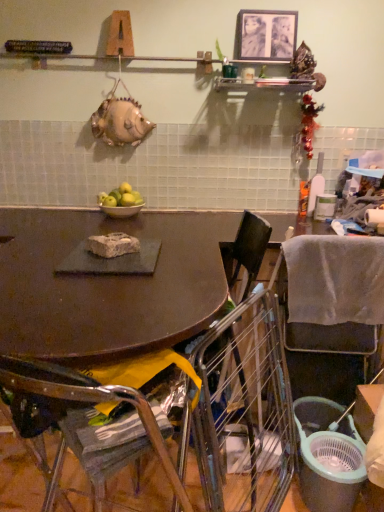
Identify the location of matte black trash can at lower right. (328, 456).

This screenshot has width=384, height=512. What are the coordinates of `metallic silver chair at lower left, the 1th chair viewed from the left` in the screenshot? It's located at (87, 402).

What do you see at coordinates (241, 411) in the screenshot? I see `metallic wire chair at lower right, the second chair when ordered from right to left` at bounding box center [241, 411].

This screenshot has height=512, width=384. What do you see at coordinates (266, 34) in the screenshot?
I see `metallic silver picture frame at upper center` at bounding box center [266, 34].

What is the approximate width of matte black table at center?

matte black table at center is 96.86 centimeters wide.

What do you see at coordinates (122, 210) in the screenshot? The height and width of the screenshot is (512, 384). I see `metallic silver bowl at center` at bounding box center [122, 210].

Where is `metallic silver shelf at upper center`? This screenshot has height=512, width=384. metallic silver shelf at upper center is located at coordinates (285, 78).

Is matte black table at center turned away from metallic silver picture frame at upper center?

No, metallic silver picture frame at upper center is not at the back of matte black table at center.

Which is closer, (131, 313) or (247, 58)?

Clearly, point (131, 313) is closer to the camera than point (247, 58).

From the image's perspective, is matte black table at center beneath metallic silver picture frame at upper center?

Indeed, from the image's perspective, matte black table at center is shown beneath metallic silver picture frame at upper center.

How much distance is there between matte black table at center and metallic silver picture frame at upper center?

A distance of 1.11 meters exists between matte black table at center and metallic silver picture frame at upper center.

Looking at this image, is metallic wire chair at lower right, the second chair when ordered from right to left, oriented towards metallic silver bowl at center?

No, metallic wire chair at lower right, the second chair when ordered from right to left, is not turned towards metallic silver bowl at center.

Considering the relative positions of metallic wire chair at lower right, acting as the 2th chair starting from the left, and metallic silver bowl at center in the image provided, is metallic wire chair at lower right, acting as the 2th chair starting from the left, to the left of metallic silver bowl at center from the viewer's perspective?

No, metallic wire chair at lower right, acting as the 2th chair starting from the left, is not to the left of metallic silver bowl at center.

How distant is metallic wire chair at lower right, acting as the 2th chair starting from the left, from metallic silver bowl at center?

They are 1.06 meters apart.

Is metallic silver shelf at upper center oriented away from gray fabric chair at lower right, which is the 1th chair from right to left?

No, metallic silver shelf at upper center is not facing away from gray fabric chair at lower right, which is the 1th chair from right to left.

Considering the points (272, 63) and (305, 272), which point is in front, point (272, 63) or point (305, 272)?

The point (305, 272) is closer.

From the image's perspective, would you say metallic silver shelf at upper center is shown under gray fabric chair at lower right, positioned as the third chair in left-to-right order?

No, from the image's perspective, metallic silver shelf at upper center is not beneath gray fabric chair at lower right, positioned as the third chair in left-to-right order.

Can you confirm if metallic silver shelf at upper center is smaller than gray fabric chair at lower right, positioned as the third chair in left-to-right order?

Yes.

Does metallic silver chair at lower left, the 1th chair viewed from the left, lie in front of matte black table at center?

Yes, metallic silver chair at lower left, the 1th chair viewed from the left, is in front of matte black table at center.

Between metallic silver chair at lower left, the 1th chair viewed from the left, and matte black table at center, which one has larger size?

With larger size is matte black table at center.

Considering the sizes of objects metallic silver chair at lower left, the 1th chair viewed from the left, and matte black table at center in the image provided, who is shorter, metallic silver chair at lower left, the 1th chair viewed from the left, or matte black table at center?

Standing shorter between the two is metallic silver chair at lower left, the 1th chair viewed from the left.

This screenshot has height=512, width=384. Identify the location of shelf located in front of the green matte apples at center. (285, 78).

From the picture: Do you think metallic silver shelf at upper center is within green matte apples at center, or outside of it?

metallic silver shelf at upper center exists outside the volume of green matte apples at center.

From a real-world perspective, between metallic silver shelf at upper center and green matte apples at center, who is vertically higher?

In real-world perspective, metallic silver shelf at upper center is above.

Is metallic silver shelf at upper center closer to camera compared to green matte apples at center?

That is True.

Which is more to the left, matte black table at center or gray fabric chair at lower right, positioned as the third chair in left-to-right order?

matte black table at center is more to the left.

Does matte black table at center have a greater height compared to gray fabric chair at lower right, which is the 1th chair from right to left?

No.

Would you consider matte black table at center to be distant from gray fabric chair at lower right, which is the 1th chair from right to left?

matte black table at center is near gray fabric chair at lower right, which is the 1th chair from right to left, not far away.

Which of these two, gray fabric chair at lower right, which is the 1th chair from right to left, or matte black table at center, is thinner?

gray fabric chair at lower right, which is the 1th chair from right to left.

Is gray fabric chair at lower right, positioned as the third chair in left-to-right order, located outside matte black table at center?

Yes, gray fabric chair at lower right, positioned as the third chair in left-to-right order, is outside of matte black table at center.

In terms of height, does gray fabric chair at lower right, which is the 1th chair from right to left, look taller or shorter compared to matte black table at center?

Clearly, gray fabric chair at lower right, which is the 1th chair from right to left, is taller compared to matte black table at center.

At what (x,y) coordinates should I click in order to perform the action: click on desk in front of the metallic silver picture frame at upper center. Please return your answer as a coordinate pair (x, y). The image size is (384, 512). Looking at the image, I should click on (106, 285).

In the image, there is a metallic wire chair at lower right, the second chair when ordered from right to left. At what (x,y) coordinates should I click in order to perform the action: click on bowl above it (from the image's perspective). Please return your answer as a coordinate pair (x, y). Looking at the image, I should click on (122, 210).

Which object lies nearer to the anchor point gray fabric chair at lower right, positioned as the third chair in left-to-right order, metallic silver shelf at upper center or matte black table at center?

Based on the image, matte black table at center appears to be nearer to gray fabric chair at lower right, positioned as the third chair in left-to-right order.

Looking at the image, which one is located further to green matte apples at center, metallic silver bowl at center or gray fabric chair at lower right, which is the 1th chair from right to left?

Based on the image, gray fabric chair at lower right, which is the 1th chair from right to left, appears to be further to green matte apples at center.

When comparing their distances from green matte apples at center, does matte black trash can at lower right or metallic silver shelf at upper center seem further?

matte black trash can at lower right is further to green matte apples at center.

From the image, which object appears to be nearer to matte black table at center, green matte apples at center or metallic wire chair at lower right, the second chair when ordered from right to left?

metallic wire chair at lower right, the second chair when ordered from right to left.

From the image, which object appears to be farther from metallic silver chair at lower left, the 1th chair viewed from the left, gray fabric chair at lower right, which is the 1th chair from right to left, or metallic silver shelf at upper center?

metallic silver shelf at upper center lies further to metallic silver chair at lower left, the 1th chair viewed from the left, than the other object.

Which object lies nearer to the anchor point green matte apples at center, metallic silver picture frame at upper center or metallic silver shelf at upper center?

Among the two, metallic silver shelf at upper center is located nearer to green matte apples at center.

When comparing their distances from gray fabric chair at lower right, which is the 1th chair from right to left, does metallic silver bowl at center or metallic silver shelf at upper center seem further?

The object further to gray fabric chair at lower right, which is the 1th chair from right to left, is metallic silver shelf at upper center.

When comparing their distances from green matte apples at center, does metallic silver chair at lower left, the 1th chair viewed from the left, or metallic silver bowl at center seem closer?

Among the two, metallic silver bowl at center is located nearer to green matte apples at center.

I want to click on shelf between metallic silver chair at lower left, the 1th chair viewed from the left, and metallic silver bowl at center, along the z-axis, so click(285, 78).

Locate an element on the screen. The image size is (384, 512). bowl that lies between green matte apples at center and matte black trash can at lower right from top to bottom is located at coordinates 122,210.

Where is `apple that lies between metallic silver picture frame at upper center and metallic silver bowl at center from top to bottom`? Image resolution: width=384 pixels, height=512 pixels. apple that lies between metallic silver picture frame at upper center and metallic silver bowl at center from top to bottom is located at coordinates (120, 197).

Locate an element on the screen. This screenshot has width=384, height=512. apple between metallic silver shelf at upper center and matte black trash can at lower right from top to bottom is located at coordinates (120, 197).